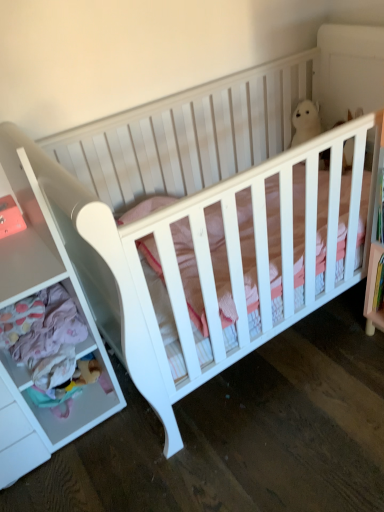
Question: Could you tell me if soft plush bear at lower left is turned towards white matte drawer at left?

Choices:
 (A) yes
 (B) no

Answer: (A)

Question: From the image's perspective, is soft plush bear at lower left below white matte drawer at left?

Choices:
 (A) no
 (B) yes

Answer: (B)

Question: From the image's perspective, is soft plush bear at lower left over white matte drawer at left?

Choices:
 (A) no
 (B) yes

Answer: (A)

Question: Is soft plush bear at lower left facing away from white matte drawer at left?

Choices:
 (A) yes
 (B) no

Answer: (A)

Question: Are soft plush bear at lower left and white matte drawer at left far apart?

Choices:
 (A) yes
 (B) no

Answer: (B)

Question: Is white matte drawer at left wider or thinner than white plush bear at upper center?

Choices:
 (A) wide
 (B) thin

Answer: (A)

Question: In terms of size, does white matte drawer at left appear bigger or smaller than white plush bear at upper center?

Choices:
 (A) small
 (B) big

Answer: (B)

Question: Is point (84, 415) closer or farther from the camera than point (301, 117)?

Choices:
 (A) farther
 (B) closer

Answer: (B)

Question: From a real-world perspective, is white matte drawer at left positioned above or below white plush bear at upper center?

Choices:
 (A) below
 (B) above

Answer: (A)

Question: Is point (309, 134) closer or farther from the camera than point (29, 418)?

Choices:
 (A) farther
 (B) closer

Answer: (A)

Question: Relative to white matte drawer at left, is white plush bear at upper center in front or behind?

Choices:
 (A) front
 (B) behind

Answer: (B)

Question: Considering the positions of white plush bear at upper center and white matte drawer at left in the image, is white plush bear at upper center taller or shorter than white matte drawer at left?

Choices:
 (A) tall
 (B) short

Answer: (B)

Question: From a real-world perspective, is white plush bear at upper center physically located above or below white matte drawer at left?

Choices:
 (A) below
 (B) above

Answer: (B)

Question: Looking at their shapes, would you say soft plush bear at lower left is wider or thinner than white plush bear at upper center?

Choices:
 (A) wide
 (B) thin

Answer: (B)

Question: Considering the positions of point (79, 381) and point (291, 121), is point (79, 381) closer or farther from the camera than point (291, 121)?

Choices:
 (A) farther
 (B) closer

Answer: (B)